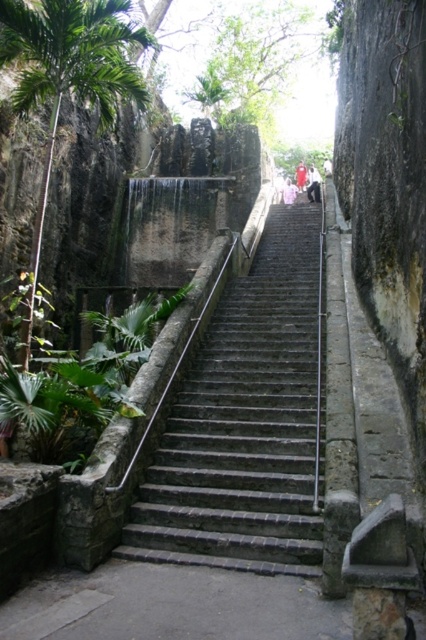
Question: Does white cotton shirt at upper center appear over pink fabric at upper center?

Choices:
 (A) no
 (B) yes

Answer: (A)

Question: Among these points, which one is farthest from the camera?

Choices:
 (A) (302, 182)
 (B) (299, 232)
 (C) (311, 184)
 (D) (287, 193)

Answer: (D)

Question: Can you confirm if pink fabric at upper center is bigger than light pink fabric at upper center?

Choices:
 (A) yes
 (B) no

Answer: (A)

Question: Which of the following is the closest to the observer?

Choices:
 (A) pink fabric at upper center
 (B) white cotton shirt at upper center

Answer: (B)

Question: Can you confirm if gray stone stairs at center is positioned to the right of white cotton shirt at upper center?

Choices:
 (A) no
 (B) yes

Answer: (A)

Question: Among these points, which one is farthest from the camera?

Choices:
 (A) (316, 198)
 (B) (301, 166)

Answer: (B)